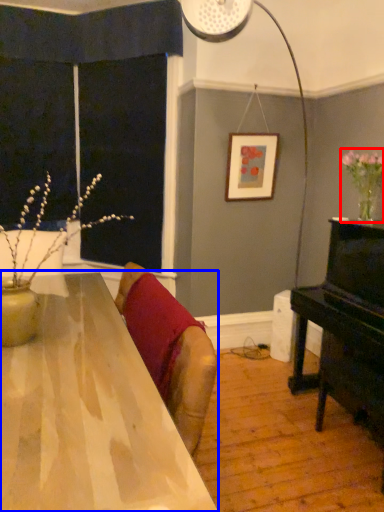
Question: Among these objects, which one is nearest to the camera, floral arrangement (highlighted by a red box) or table (highlighted by a blue box)?

Choices:
 (A) floral arrangement
 (B) table

Answer: (B)